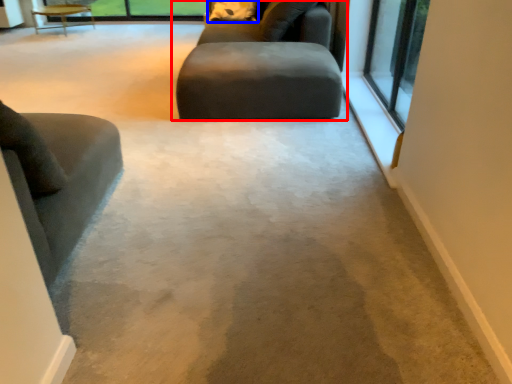
Question: Which point is closer to the camera, studio couch (highlighted by a red box) or pillow (highlighted by a blue box)?

Choices:
 (A) studio couch
 (B) pillow

Answer: (A)